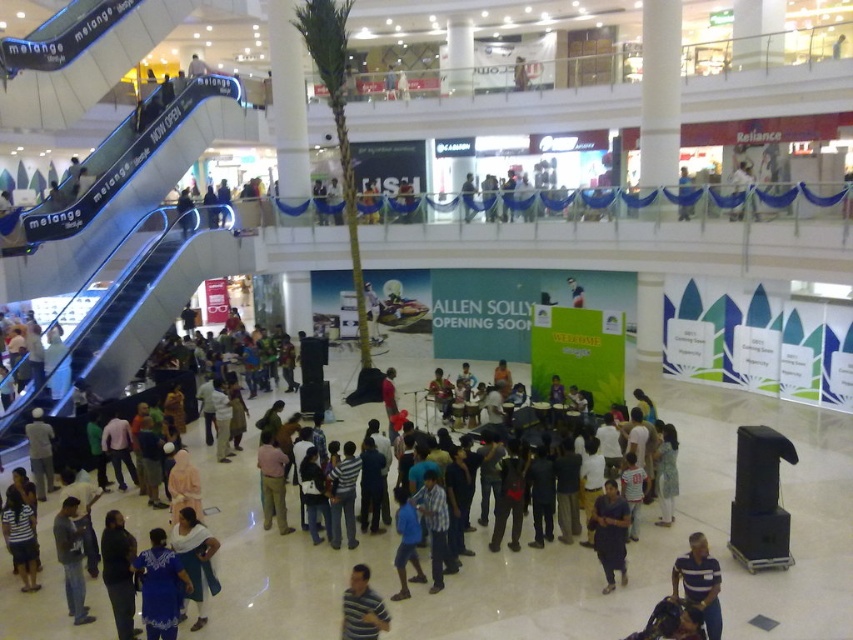
Does dark blue shirt at center have a larger size compared to blue fabric umbrella at center?

No.

Is dark blue shirt at center to the left of blue fabric umbrella at center from the viewer's perspective?

Yes, dark blue shirt at center is to the left of blue fabric umbrella at center.

Which is in front, point (622, 541) or point (689, 209)?

Point (622, 541) is in front.

The image size is (853, 640). In order to click on dark blue shirt at center in this screenshot , I will do `click(610, 532)`.

Looking at this image, between dark gray sweater at lower left and striped shirt at center, which one is positioned lower?

dark gray sweater at lower left

Consider the image. Does dark gray sweater at lower left have a greater width compared to striped shirt at center?

Yes.

Between point (68, 600) and point (363, 608), which one is positioned in front?

Point (363, 608) is more forward.

Image resolution: width=853 pixels, height=640 pixels. What are the coordinates of `dark gray sweater at lower left` in the screenshot? It's located at (71, 557).

Is dark blue shirt at center further to the viewer compared to white fabric at upper center?

No, dark blue shirt at center is in front of white fabric at upper center.

Is point (627, 516) farther from viewer compared to point (749, 204)?

That is False.

Where is `dark blue shirt at center`? Image resolution: width=853 pixels, height=640 pixels. dark blue shirt at center is located at coordinates [610, 532].